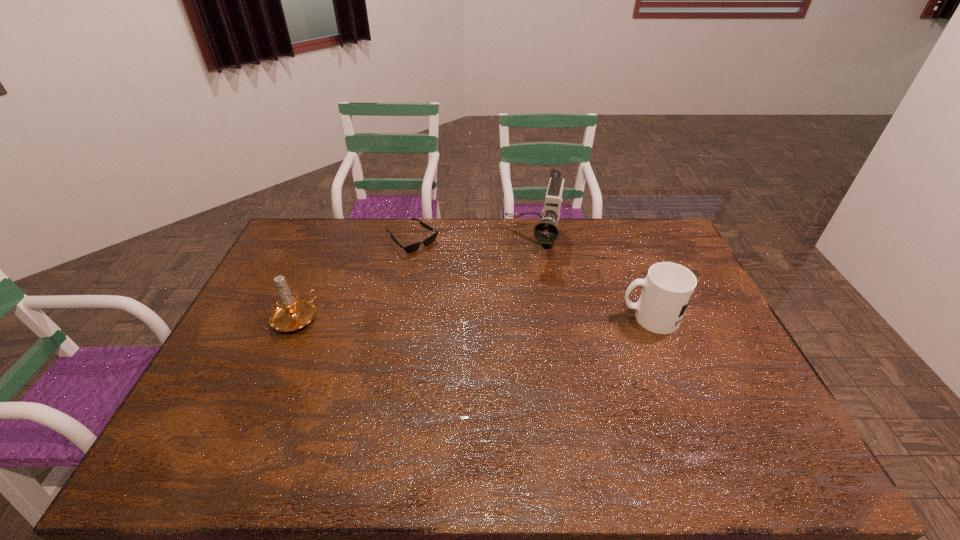
Find the location of a particular element. This screenshot has height=540, width=960. vacant point located between the candle and the rightmost object is located at coordinates (472, 318).

Where is `free space between the candle and the sunglasses`? free space between the candle and the sunglasses is located at coordinates (354, 279).

Locate an element on the screen. Image resolution: width=960 pixels, height=540 pixels. vacant region between the third object from right to left and the third object from left to right is located at coordinates (473, 243).

Where is `free area in between the camcorder and the third object from right to left`? The image size is (960, 540). free area in between the camcorder and the third object from right to left is located at coordinates (473, 243).

Identify which object is the second closest to the tallest object. Please provide its 2D coordinates. Your answer should be formatted as a tuple, i.e. [(x, y)], where the tuple contains the x and y coordinates of a point satisfying the conditions above.

[(413, 247)]

Find the location of a particular element. The height and width of the screenshot is (540, 960). object identified as the closest to the second object from left to right is located at coordinates (546, 232).

Image resolution: width=960 pixels, height=540 pixels. What are the coordinates of `vacant space that satisfies the following two spatial constraints: 1. on the front side of the sunglasses; 2. on the handle side of the rightmost object` in the screenshot? It's located at (397, 318).

Find the location of a particular element. Image resolution: width=960 pixels, height=540 pixels. free space that satisfies the following two spatial constraints: 1. on the front side of the mug; 2. on the handle side of the third object from right to left is located at coordinates (397, 318).

Where is `free location that satisfies the following two spatial constraints: 1. on the back side of the rightmost object; 2. on the handle side of the leftmost object`? The width and height of the screenshot is (960, 540). free location that satisfies the following two spatial constraints: 1. on the back side of the rightmost object; 2. on the handle side of the leftmost object is located at coordinates (296, 318).

Locate an element on the screen. vacant area in the image that satisfies the following two spatial constraints: 1. on the back side of the sunglasses; 2. on the right side of the candle is located at coordinates (329, 240).